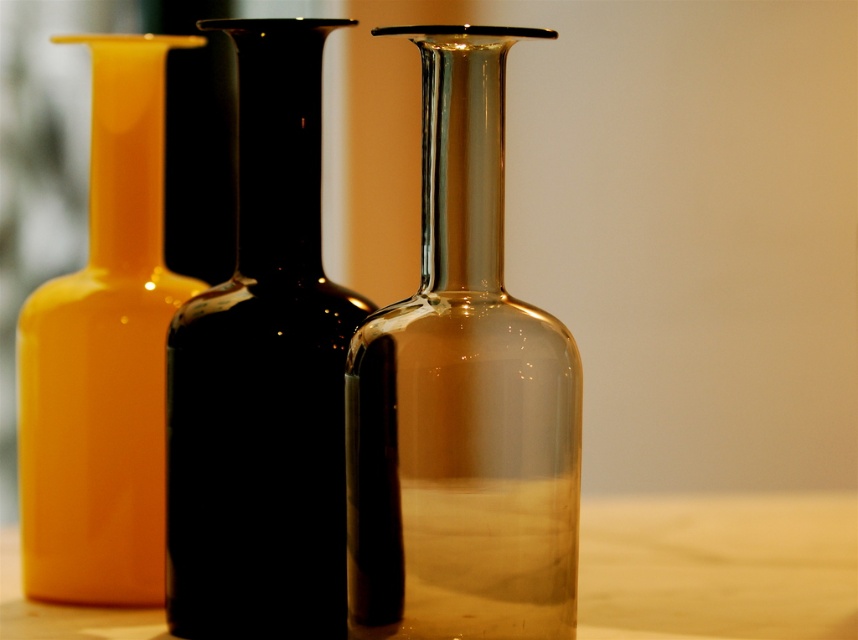
You are arranging items on a shelf and need to place the transparent glass bottle at center and the matte yellow vase at left. If the shelf has a width of 10 cm, can both items fit side by side?

The transparent glass bottle at center is thinner than the matte yellow vase at left. However, without knowing the exact widths of each item, it is impossible to determine if their combined width would exceed the 10 cm shelf space. Additional measurements are needed.

You are holding a small toy that is 1 inch in diameter. You want to place it exactly at the point marked by point (497, 307). Can you estimate if the toy will fit at that location without overlapping any objects in the scene?

The point (497, 307) is 12.85 inches from the viewer. Since the toy is only 1 inch in diameter, there is sufficient space at that location to place the toy without overlapping any objects in the scene.